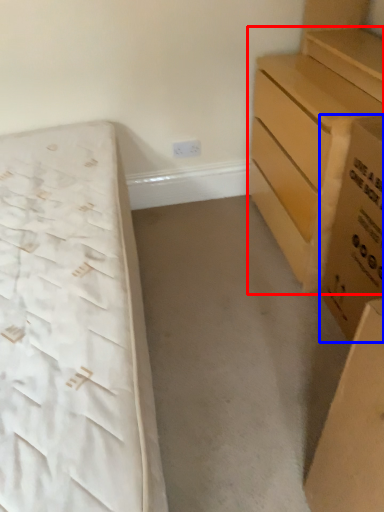
Question: Which of the following is the closest to the observer, chest of drawers (highlighted by a red box) or cardboard box (highlighted by a blue box)?

Choices:
 (A) chest of drawers
 (B) cardboard box

Answer: (B)